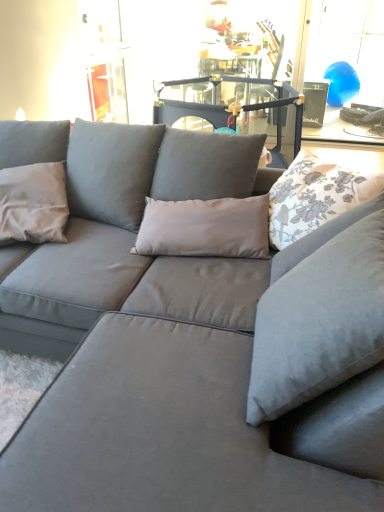
Question: Is white floral fabric pillow at upper right, arranged as the second pillow when viewed from the left, touching matte gray pillow at left, the first pillow from the left?

Choices:
 (A) no
 (B) yes

Answer: (A)

Question: Is white floral fabric pillow at upper right, acting as the 1th pillow starting from the right, facing towards matte gray pillow at left, the first pillow from the left?

Choices:
 (A) no
 (B) yes

Answer: (A)

Question: Would you say matte gray pillow at left, the first pillow from the left, is part of white floral fabric pillow at upper right, arranged as the second pillow when viewed from the left,'s contents?

Choices:
 (A) yes
 (B) no

Answer: (B)

Question: Considering the relative positions of white floral fabric pillow at upper right, acting as the 1th pillow starting from the right, and matte gray pillow at left, the 2th pillow positioned from the right, in the image provided, is white floral fabric pillow at upper right, acting as the 1th pillow starting from the right, behind matte gray pillow at left, the 2th pillow positioned from the right,?

Choices:
 (A) no
 (B) yes

Answer: (A)

Question: Is white floral fabric pillow at upper right, arranged as the second pillow when viewed from the left, taller than matte gray pillow at left, the first pillow from the left?

Choices:
 (A) yes
 (B) no

Answer: (B)

Question: Is white floral fabric pillow at upper right, arranged as the second pillow when viewed from the left, oriented away from matte gray pillow at left, the first pillow from the left?

Choices:
 (A) no
 (B) yes

Answer: (A)

Question: Are blue glossy balloon at upper right and matte gray pillow at left, the 2th pillow positioned from the right, beside each other?

Choices:
 (A) yes
 (B) no

Answer: (B)

Question: Considering the relative sizes of blue glossy balloon at upper right and matte gray pillow at left, the 2th pillow positioned from the right, in the image provided, is blue glossy balloon at upper right thinner than matte gray pillow at left, the 2th pillow positioned from the right,?

Choices:
 (A) no
 (B) yes

Answer: (B)

Question: Would you say blue glossy balloon at upper right is outside matte gray pillow at left, the first pillow from the left?

Choices:
 (A) no
 (B) yes

Answer: (B)

Question: Is blue glossy balloon at upper right oriented towards matte gray pillow at left, the first pillow from the left?

Choices:
 (A) yes
 (B) no

Answer: (B)

Question: Is blue glossy balloon at upper right wider than matte gray pillow at left, the first pillow from the left?

Choices:
 (A) no
 (B) yes

Answer: (A)

Question: From a real-world perspective, does blue glossy balloon at upper right stand above matte gray pillow at left, the first pillow from the left?

Choices:
 (A) yes
 (B) no

Answer: (A)

Question: Is blue glossy balloon at upper right taller than white floral fabric pillow at upper right, arranged as the second pillow when viewed from the left?

Choices:
 (A) yes
 (B) no

Answer: (A)